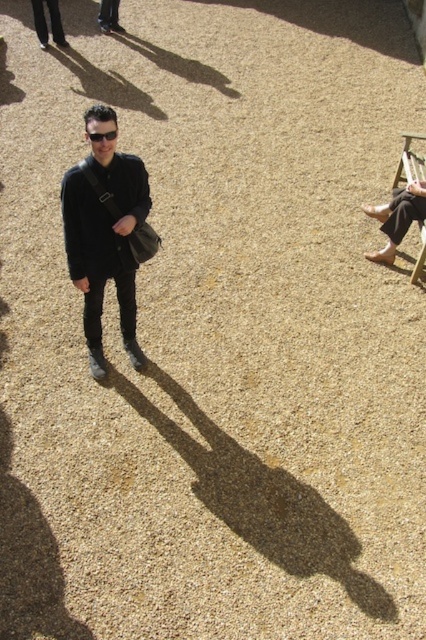
You are standing at the center of the gravelly ground and want to walk towards the wooden at right. What direction should you move in?

Since the wooden at right is located at point 0.253 on the x and 0.962 on the y, you should move to the right and forward to reach it.

You are standing at the point with coordinates point [106,140] and want to walk towards the point with coordinates point [120,280]. Since you can only move forward, will you be moving towards the camera or away from it?

Point [120,280] is further to the camera than point [106,140]. Therefore, moving from point [106,140] towards point [120,280] means you are moving towards the camera.

You are taking a photo from above and notice two points on the gravelly ground surface. The first point is at coordinates point [422,138] and the second point is at point [100,134]. Which point is closer to your camera lens?

Point [422,138] is further to the camera than point [100,134], so the point closer to the camera lens is point [100,134].